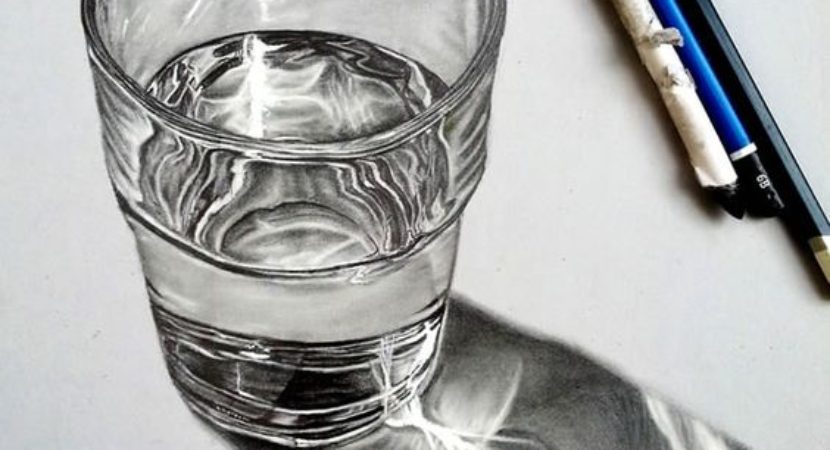
Locate an element on the screen. glass is located at coordinates (416, 269).